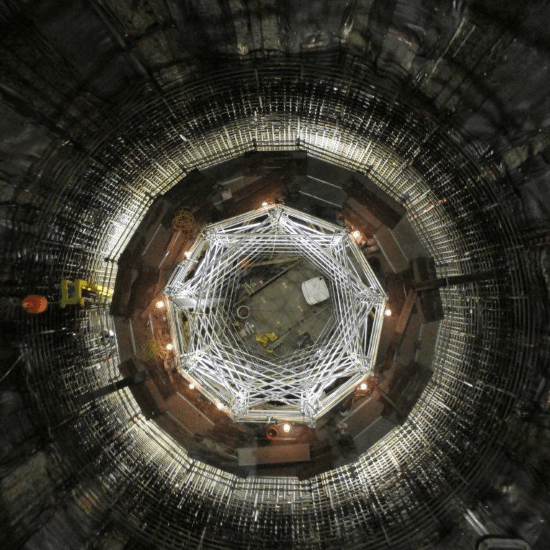
Find the location of a particular element. The image size is (550, 550). bowl is located at coordinates (243, 313).